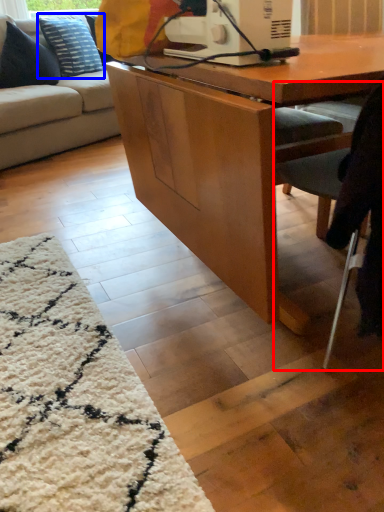
Question: Among these objects, which one is farthest to the camera, chair (highlighted by a red box) or pillow (highlighted by a blue box)?

Choices:
 (A) chair
 (B) pillow

Answer: (B)